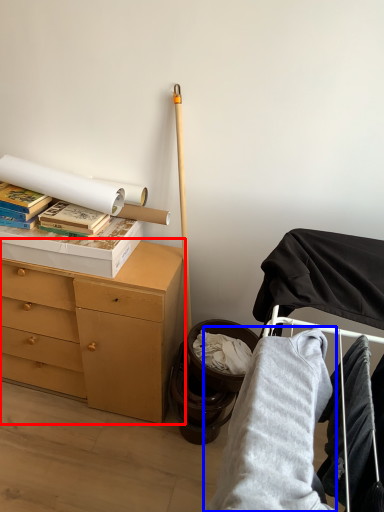
Question: Which object is further to the camera taking this photo, chest of drawers (highlighted by a red box) or clothing (highlighted by a blue box)?

Choices:
 (A) chest of drawers
 (B) clothing

Answer: (A)